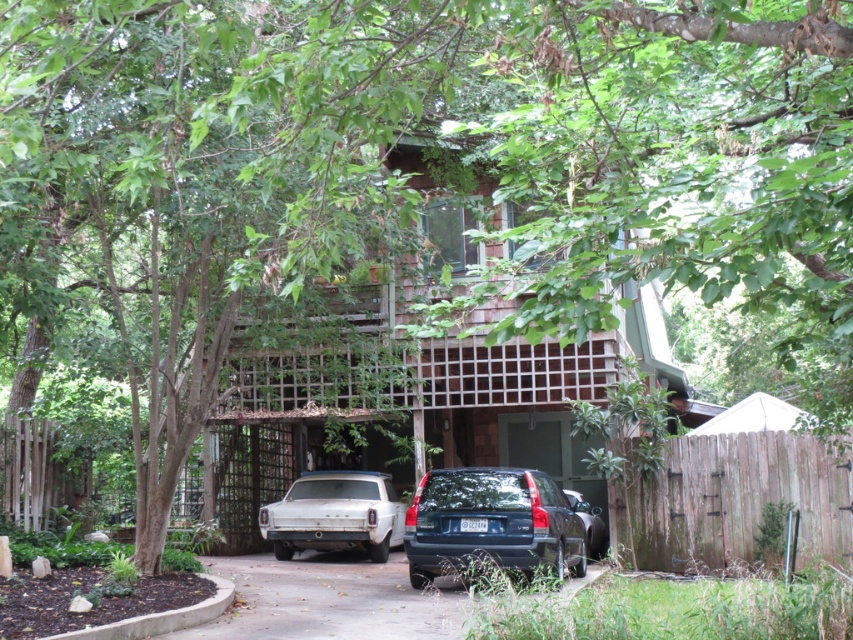
You are standing in front of the house and want to take a photo of both the vintage car and the SUV. The vintage car is at point (x=227, y=560) and the SUV is at point (x=474, y=470). Which point is closer to your camera so that you can focus on it first?

Point (x=227, y=560) is further to the camera than point (x=474, y=470), so the vintage car at point (x=227, y=560) is closer to the camera and should be focused on first.

You are standing at the front door of the house and want to move to the matte dark blue suv at center. Which direction should you walk to reach it?

The matte dark blue suv at center is located at point [491,524] in the scene, so you should walk forward and to the right from the front door to reach it.